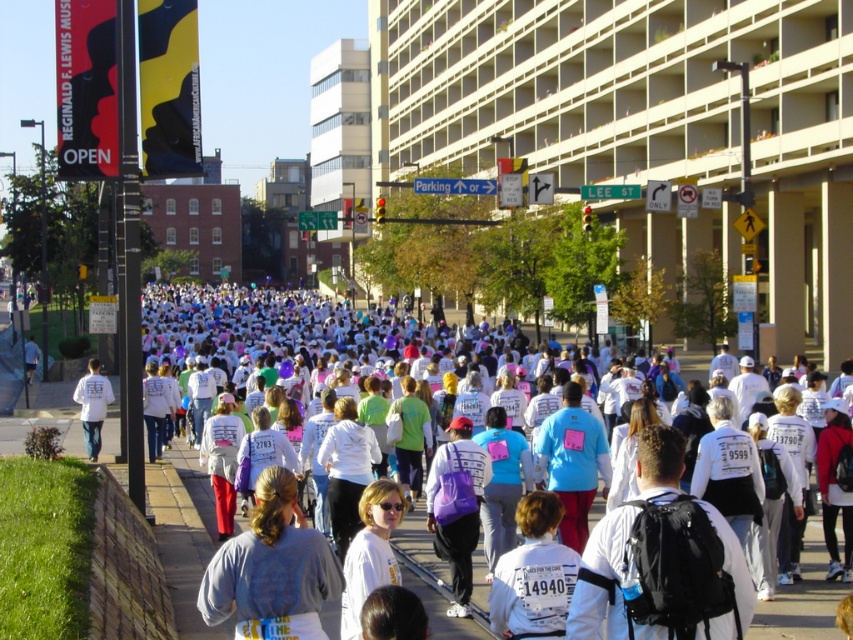
Between point (329, 316) and point (230, 552), which one is positioned in front?

Point (230, 552)

Is white fabric crowd at center thinner than gray cotton shirt at lower left?

No.

Which is behind, point (155, 312) or point (299, 625)?

Point (155, 312)

Identify the location of white fabric crowd at center. This screenshot has width=853, height=640. (231, 305).

Which is below, white fabric crowd at center or purple fabric bag at center?

purple fabric bag at center is below.

Between white fabric crowd at center and purple fabric bag at center, which one appears on the left side from the viewer's perspective?

white fabric crowd at center

Where is `white fabric crowd at center`? white fabric crowd at center is located at coordinates click(x=231, y=305).

Is white matte shirt at center smaller than white matte shirt at lower left?

Yes.

Is white matte shirt at center thinner than white matte shirt at lower left?

Indeed, white matte shirt at center has a lesser width compared to white matte shirt at lower left.

Find the location of `white matte shirt at center`. white matte shirt at center is located at coordinates (660, 557).

Identify the location of white matte shirt at center. This screenshot has height=640, width=853. (660, 557).